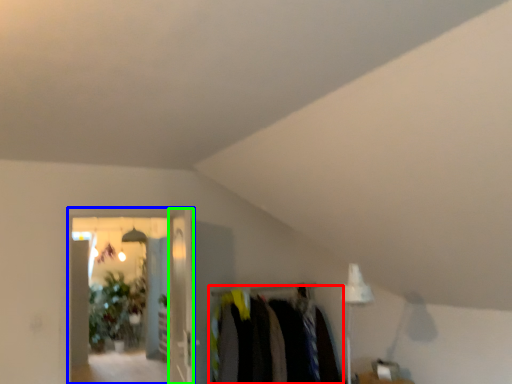
Question: Estimate the real-world distances between objects in this image. Which object is farther from closet (highlighted by a red box), glass door (highlighted by a blue box) or glass door (highlighted by a green box)?

Choices:
 (A) glass door
 (B) glass door

Answer: (A)